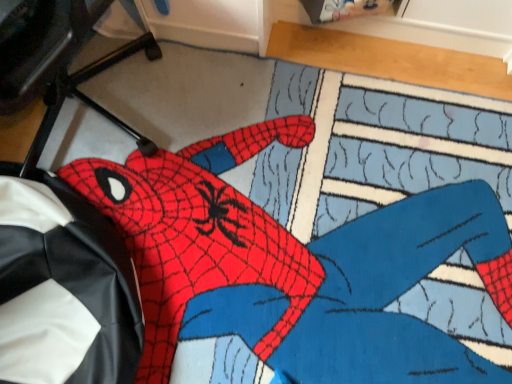
Image resolution: width=512 pixels, height=384 pixels. Describe the element at coordinates (294, 266) in the screenshot. I see `red matte spider-man figure at center` at that location.

Locate an element on the screen. black leather bean bag chair at left is located at coordinates (64, 289).

In order to click on red matte spider-man figure at center in this screenshot , I will do `click(294, 266)`.

Which of these two, red matte spider-man figure at center or black leather computer chair at lower left, is wider?

red matte spider-man figure at center.

Is red matte spider-man figure at center positioned with its back to black leather computer chair at lower left?

No, black leather computer chair at lower left is not at the back of red matte spider-man figure at center.

Between point (368, 294) and point (53, 124), which one is positioned in front?

Positioned in front is point (368, 294).

Is red matte spider-man figure at center positioned beyond the bounds of black leather computer chair at lower left?

Absolutely, red matte spider-man figure at center is external to black leather computer chair at lower left.

Is black leather bean bag chair at left to the left or to the right of red matte spider-man figure at center in the image?

In the image, black leather bean bag chair at left appears on the left side of red matte spider-man figure at center.

Is black leather bean bag chair at left facing away from red matte spider-man figure at center?

No.

Based on the photo, would you say black leather bean bag chair at left is outside red matte spider-man figure at center?

Yes, black leather bean bag chair at left is outside of red matte spider-man figure at center.

Looking at this image, is black leather computer chair at lower left thinner than black leather bean bag chair at left?

Incorrect, the width of black leather computer chair at lower left is not less than that of black leather bean bag chair at left.

Between black leather computer chair at lower left and black leather bean bag chair at left, which one is positioned in front?

black leather computer chair at lower left is in front.

In terms of height, does black leather computer chair at lower left look taller or shorter compared to black leather bean bag chair at left?

Clearly, black leather computer chair at lower left is taller compared to black leather bean bag chair at left.

Who is smaller, black leather computer chair at lower left or black leather bean bag chair at left?

With smaller size is black leather bean bag chair at left.

Based on the photo, which object is more forward, red matte spider-man figure at center or black leather bean bag chair at left?

Positioned in front is black leather bean bag chair at left.

Are red matte spider-man figure at center and black leather bean bag chair at left located far from each other?

That's not correct — red matte spider-man figure at center is a little close to black leather bean bag chair at left.

From a real-world perspective, which is physically below, red matte spider-man figure at center or black leather bean bag chair at left?

In real-world perspective, red matte spider-man figure at center is lower.

Is point (46, 44) less distant than point (181, 301)?

Yes, point (46, 44) is in front of point (181, 301).

Is black leather computer chair at lower left shorter than red matte spider-man figure at center?

In fact, black leather computer chair at lower left may be taller than red matte spider-man figure at center.

Can you tell me how much black leather computer chair at lower left and red matte spider-man figure at center differ in facing direction?

They differ by 58.6 degrees in their facing directions.

Is there a large distance between black leather computer chair at lower left and red matte spider-man figure at center?

They are positioned close to each other.

Based on the photo, which object is more forward, black leather bean bag chair at left or black leather computer chair at lower left?

black leather computer chair at lower left is closer to the camera.

Who is taller, black leather bean bag chair at left or black leather computer chair at lower left?

With more height is black leather computer chair at lower left.

Which object is wider, black leather bean bag chair at left or black leather computer chair at lower left?

With larger width is black leather computer chair at lower left.

From the image's perspective, would you say black leather bean bag chair at left is shown under black leather computer chair at lower left?

Yes, from the image's perspective, black leather bean bag chair at left is below black leather computer chair at lower left.

Identify the location of person on the right of black leather computer chair at lower left. The width and height of the screenshot is (512, 384). (294, 266).

This screenshot has width=512, height=384. Find the location of `bean bag chair below the red matte spider-man figure at center (from the image's perspective)`. bean bag chair below the red matte spider-man figure at center (from the image's perspective) is located at coordinates (64, 289).

Looking at this image, based on their spatial positions, is black leather computer chair at lower left or red matte spider-man figure at center closer to black leather bean bag chair at left?

red matte spider-man figure at center lies closer to black leather bean bag chair at left than the other object.

From the image, which object appears to be farther from red matte spider-man figure at center, black leather bean bag chair at left or black leather computer chair at lower left?

Among the two, black leather computer chair at lower left is located further to red matte spider-man figure at center.

Considering their positions, is red matte spider-man figure at center positioned further to black leather bean bag chair at left than black leather computer chair at lower left?

black leather computer chair at lower left.

Considering their positions, is red matte spider-man figure at center positioned closer to black leather computer chair at lower left than black leather bean bag chair at left?

Based on the image, black leather bean bag chair at left appears to be nearer to black leather computer chair at lower left.

Looking at the image, which one is located further to black leather computer chair at lower left, black leather bean bag chair at left or red matte spider-man figure at center?

red matte spider-man figure at center lies further to black leather computer chair at lower left than the other object.

Estimate the real-world distances between objects in this image. Which object is further from red matte spider-man figure at center, black leather computer chair at lower left or black leather bean bag chair at left?

The object further to red matte spider-man figure at center is black leather computer chair at lower left.

You are a GUI agent. You are given a task and a screenshot of the screen. Output one action in this format:
    pyautogui.click(x=<x>, y=<y>)
    Task: Click on the bean bag chair between black leather computer chair at lower left and red matte spider-man figure at center from left to right
    The width and height of the screenshot is (512, 384).
    Given the screenshot: What is the action you would take?
    pyautogui.click(x=64, y=289)